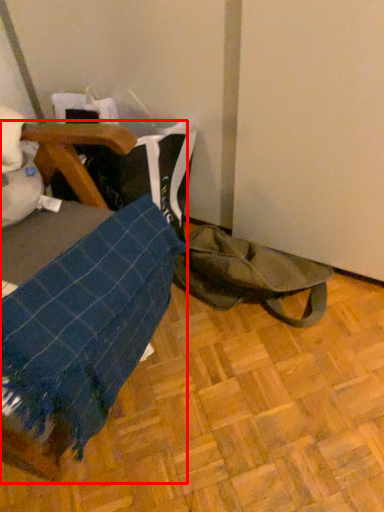
Question: From the image's perspective, what is the correct spatial relationship of furniture (annotated by the red box) in relation to tote bag?

Choices:
 (A) above
 (B) below

Answer: (B)